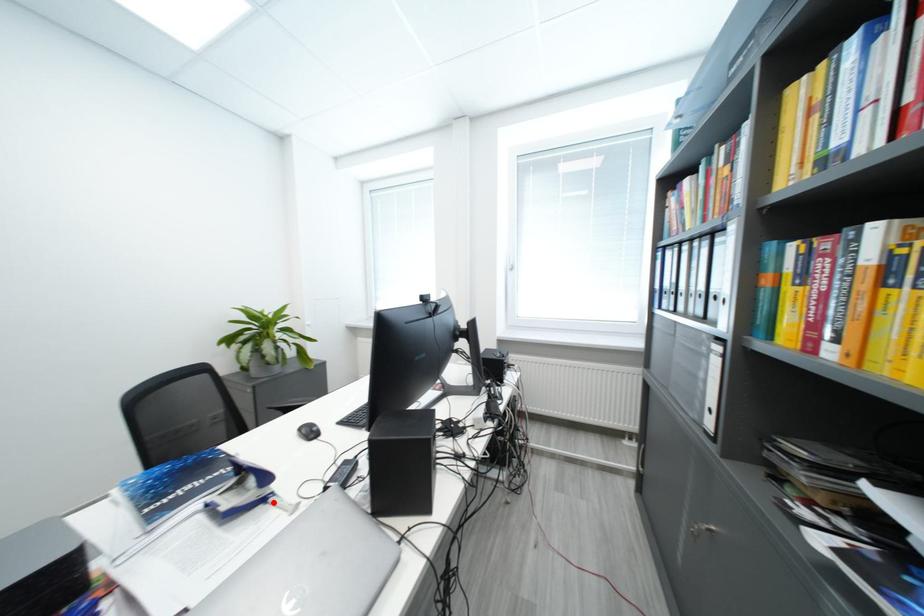
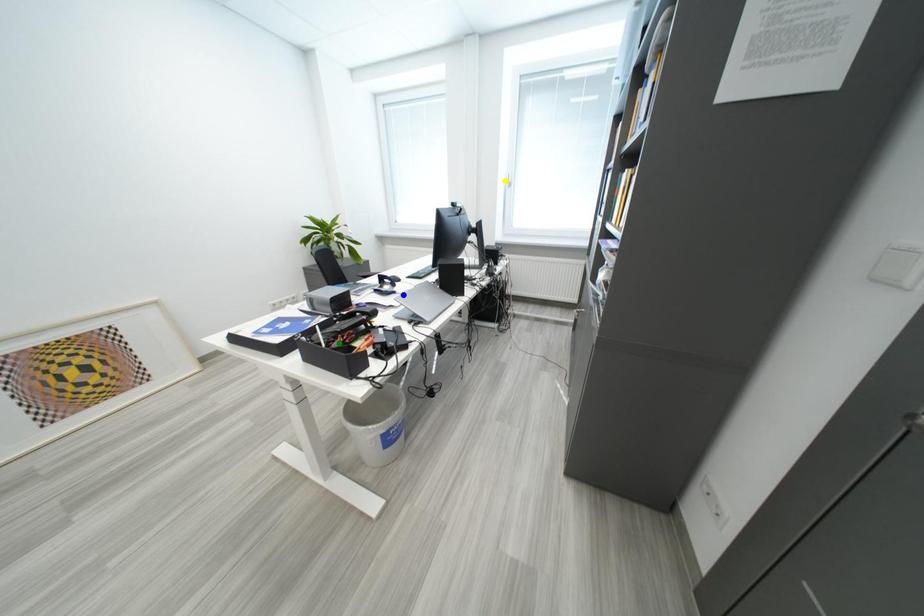
Question: I am providing you with two images of the same scene from different viewpoints. A red point is marked on the first image. You are given multiple points on the second image. Which point in image 2 is actually the same real-world point as the red point in image 1?

Choices:
 (A) yellow point
 (B) green point
 (C) blue point

Answer: (C)